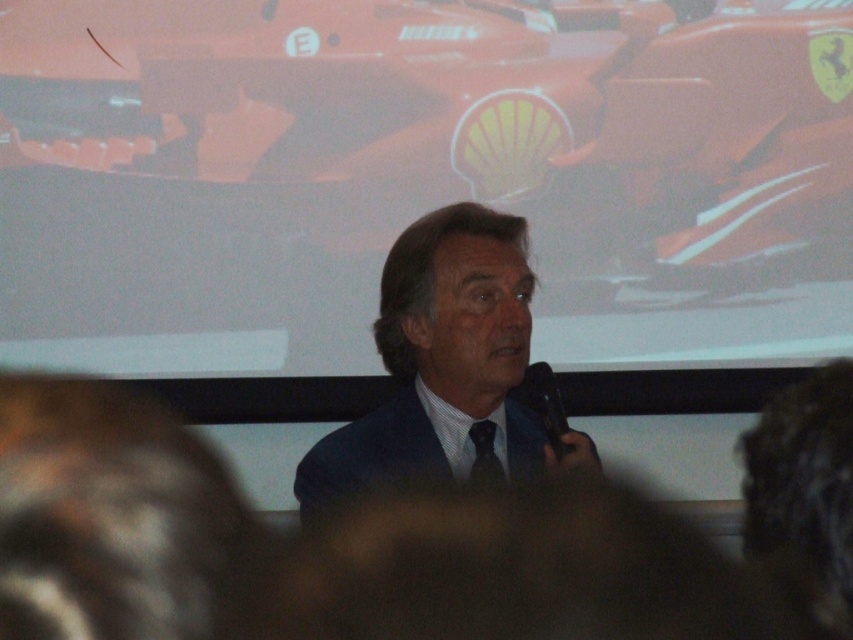
You are a photographer at the event and want to capture a clear shot of both the black plastic microphone at center and the black satin tie at center. Since the microphone is taller, which object should you focus on first to ensure depth of field captures both?

The black plastic microphone at center is taller than the black satin tie at center, so focus on the microphone first to ensure both are in focus.